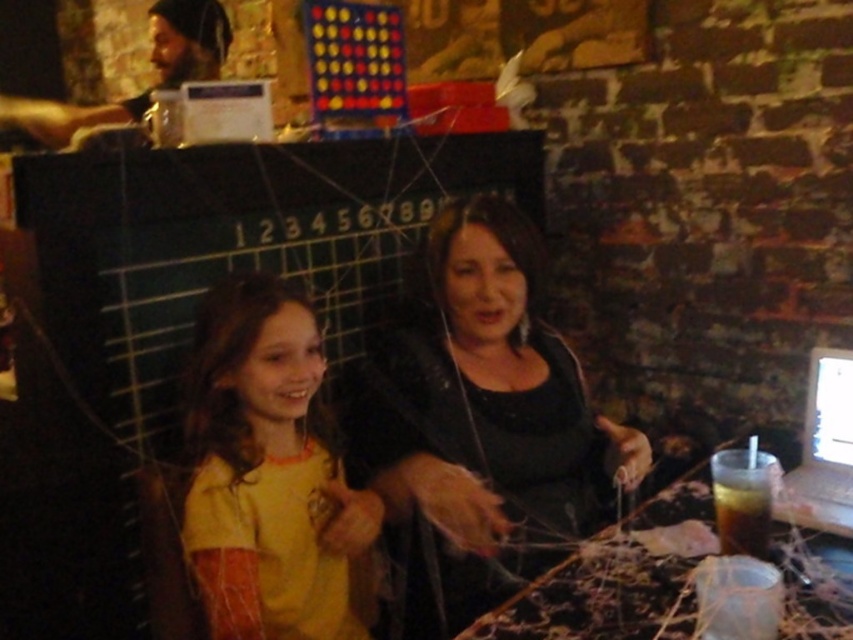
Question: Is yellow matte shirt at center bigger than dark brown liquid at lower right?

Choices:
 (A) no
 (B) yes

Answer: (B)

Question: Which object is farther from the camera taking this photo?

Choices:
 (A) white glossy computer screen at center
 (B) silver metallic laptop at right
 (C) black matte shirt at center

Answer: (A)

Question: From the image, what is the correct spatial relationship of translucent plastic table at center in relation to white glossy computer screen at center?

Choices:
 (A) below
 (B) above

Answer: (A)

Question: Estimate the real-world distances between objects in this image. Which object is farther from the white glossy computer screen at center?

Choices:
 (A) dark brown liquid at lower right
 (B) yellow matte shirt at center

Answer: (B)

Question: Is black matte shirt at center positioned before dark brown liquid at lower right?

Choices:
 (A) yes
 (B) no

Answer: (B)

Question: Which point is farther from the camera taking this photo?

Choices:
 (A) (791, 483)
 (B) (239, 282)
 (C) (817, 356)
 (D) (573, 616)

Answer: (C)